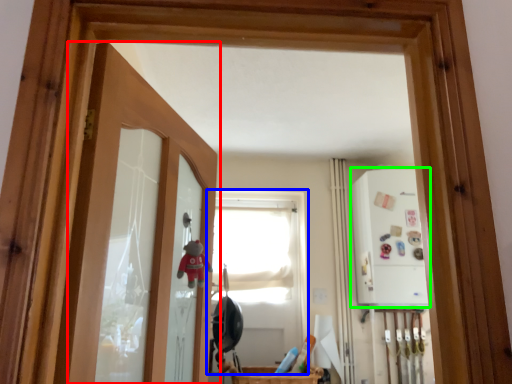
Question: Estimate the real-world distances between objects in this image. Which object is closer to door (highlighted by a red box), window (highlighted by a blue box) or medicine cabinet (highlighted by a green box)?

Choices:
 (A) window
 (B) medicine cabinet

Answer: (B)